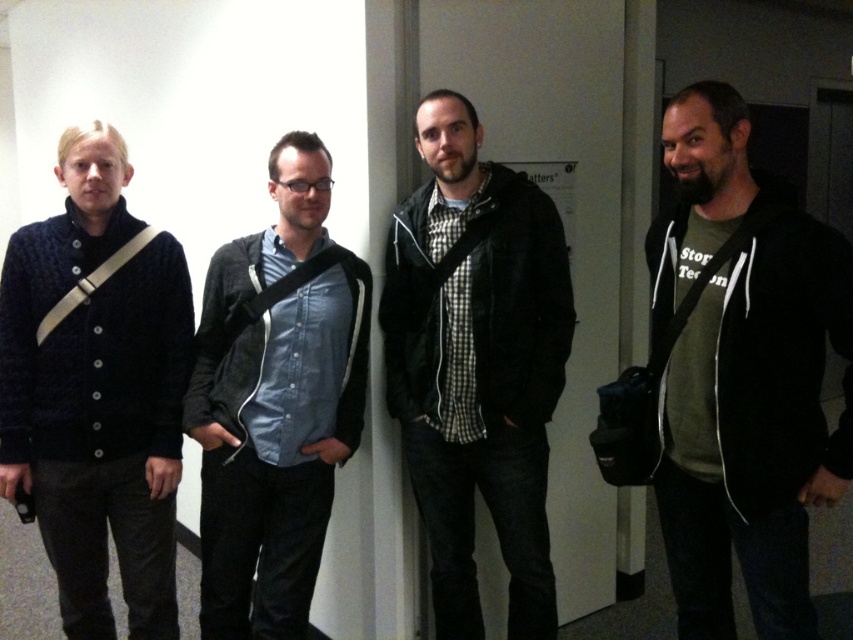
Describe the element at coordinates (743, 376) in the screenshot. This screenshot has width=853, height=640. I see `dark green hoodie at right` at that location.

Which is more to the right, dark green hoodie at right or denim shirt at center?

dark green hoodie at right

Locate an element on the screen. This screenshot has width=853, height=640. dark green hoodie at right is located at coordinates (743, 376).

You are a GUI agent. You are given a task and a screenshot of the screen. Output one action in this format:
    pyautogui.click(x=<x>, y=<y>)
    Task: Click on the knitted dark blue sweater at left
    The width and height of the screenshot is (853, 640).
    Given the screenshot: What is the action you would take?
    pyautogui.click(x=97, y=388)

Who is more forward, [73,419] or [322,252]?

Positioned in front is point [73,419].

Which is in front, point (158, 545) or point (253, 349)?

Positioned in front is point (253, 349).

Locate an element on the screen. knitted dark blue sweater at left is located at coordinates (97, 388).

Can you confirm if dark green hoodie at right is positioned above knitted dark blue sweater at left?

Indeed, dark green hoodie at right is positioned over knitted dark blue sweater at left.

Is dark green hoodie at right positioned before knitted dark blue sweater at left?

Yes, it is.

Image resolution: width=853 pixels, height=640 pixels. I want to click on dark green hoodie at right, so click(743, 376).